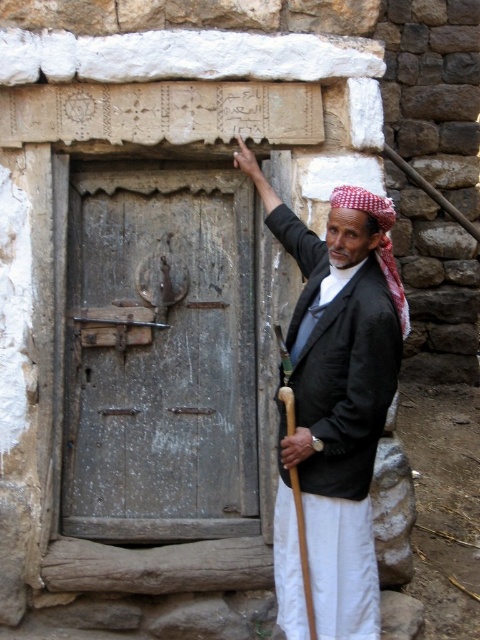
Question: From the image, what is the correct spatial relationship of weathered wood door at center in relation to black woolen jacket at center?

Choices:
 (A) below
 (B) above

Answer: (B)

Question: Can you confirm if weathered wood door at center is positioned to the left of black woolen jacket at center?

Choices:
 (A) no
 (B) yes

Answer: (B)

Question: Which object appears farthest from the camera in this image?

Choices:
 (A) weathered wood door at center
 (B) black woolen jacket at center

Answer: (A)

Question: Does weathered wood door at center have a larger size compared to black woolen jacket at center?

Choices:
 (A) no
 (B) yes

Answer: (A)

Question: Which object appears farthest from the camera in this image?

Choices:
 (A) black woolen jacket at center
 (B) weathered wood door at center

Answer: (B)